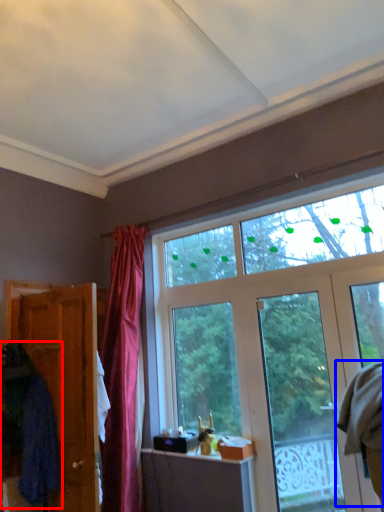
Question: Which object appears farthest to the camera in this image, robe (highlighted by a red box) or robe (highlighted by a blue box)?

Choices:
 (A) robe
 (B) robe

Answer: (B)